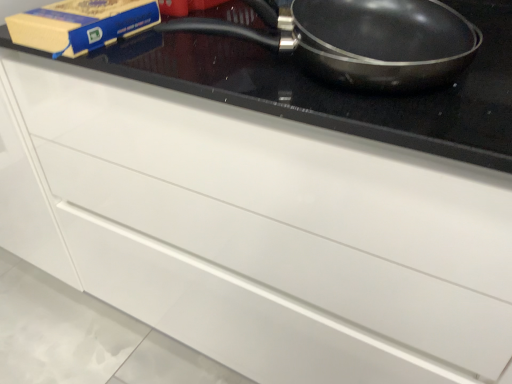
Question: Does matte blue paperback book at upper left have a lesser width compared to black non-stick frying pan at upper right?

Choices:
 (A) no
 (B) yes

Answer: (B)

Question: Is matte blue paperback book at upper left at the left side of black non-stick frying pan at upper right?

Choices:
 (A) no
 (B) yes

Answer: (B)

Question: Can you confirm if matte blue paperback book at upper left is smaller than black non-stick frying pan at upper right?

Choices:
 (A) no
 (B) yes

Answer: (B)

Question: Is matte blue paperback book at upper left shorter than black non-stick frying pan at upper right?

Choices:
 (A) no
 (B) yes

Answer: (B)

Question: Is matte blue paperback book at upper left at the right side of black non-stick frying pan at upper right?

Choices:
 (A) no
 (B) yes

Answer: (A)

Question: Considering the relative sizes of matte blue paperback book at upper left and black non-stick frying pan at upper right in the image provided, is matte blue paperback book at upper left wider than black non-stick frying pan at upper right?

Choices:
 (A) yes
 (B) no

Answer: (B)

Question: Is black non-stick frying pan at upper right in contact with matte blue paperback book at upper left?

Choices:
 (A) yes
 (B) no

Answer: (B)

Question: Can you confirm if black non-stick frying pan at upper right is positioned to the left of matte blue paperback book at upper left?

Choices:
 (A) no
 (B) yes

Answer: (A)

Question: Does black non-stick frying pan at upper right contain matte blue paperback book at upper left?

Choices:
 (A) yes
 (B) no

Answer: (B)

Question: Is black non-stick frying pan at upper right to the right of matte blue paperback book at upper left from the viewer's perspective?

Choices:
 (A) yes
 (B) no

Answer: (A)

Question: Does black non-stick frying pan at upper right come in front of matte blue paperback book at upper left?

Choices:
 (A) no
 (B) yes

Answer: (B)

Question: Does black non-stick frying pan at upper right have a greater width compared to matte blue paperback book at upper left?

Choices:
 (A) no
 (B) yes

Answer: (B)

Question: From the image's perspective, relative to black non-stick frying pan at upper right, is matte blue paperback book at upper left above or below?

Choices:
 (A) below
 (B) above

Answer: (B)